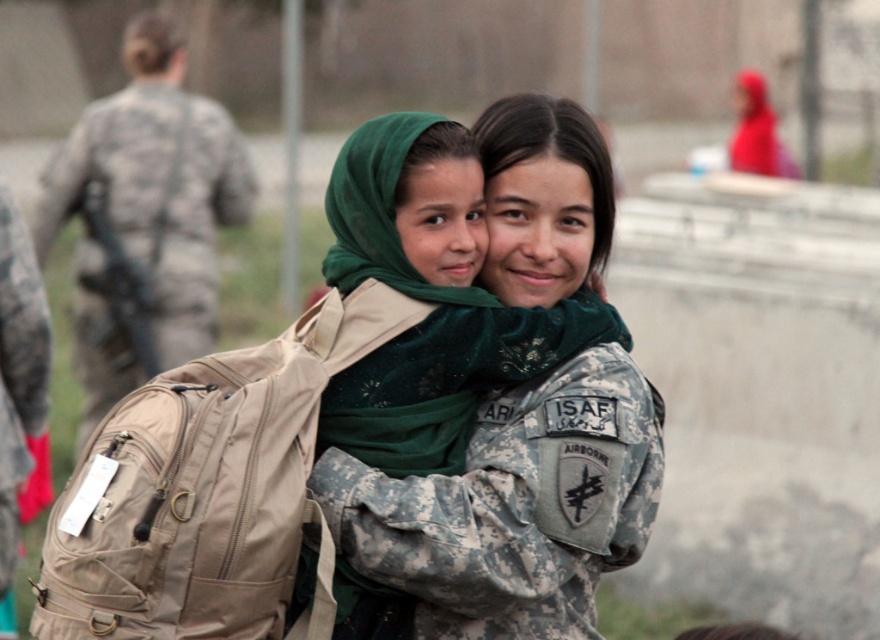
Is camouflage fabric backpack at left to the right of camouflage fabric uniform at left from the viewer's perspective?

In fact, camouflage fabric backpack at left is to the left of camouflage fabric uniform at left.

Which of these two, camouflage fabric backpack at left or camouflage fabric uniform at left, stands shorter?

Standing shorter between the two is camouflage fabric uniform at left.

Who is more distant from viewer, (x=160, y=168) or (x=30, y=416)?

Point (x=160, y=168)

This screenshot has height=640, width=880. I want to click on camouflage fabric backpack at left, so click(x=144, y=218).

Can you confirm if camouflage uniform at center is wider than camouflage fabric backpack at left?

In fact, camouflage uniform at center might be narrower than camouflage fabric backpack at left.

This screenshot has height=640, width=880. Describe the element at coordinates (523, 413) in the screenshot. I see `camouflage uniform at center` at that location.

Locate an element on the screen. Image resolution: width=880 pixels, height=640 pixels. camouflage uniform at center is located at coordinates (523, 413).

From the picture: Does camouflage uniform at center have a lesser height compared to camouflage fabric uniform at left?

Yes.

Describe the element at coordinates (523, 413) in the screenshot. The height and width of the screenshot is (640, 880). I see `camouflage uniform at center` at that location.

You are a GUI agent. You are given a task and a screenshot of the screen. Output one action in this format:
    pyautogui.click(x=<x>, y=<y>)
    Task: Click on the camouflage uniform at center
    
    Given the screenshot: What is the action you would take?
    pyautogui.click(x=523, y=413)